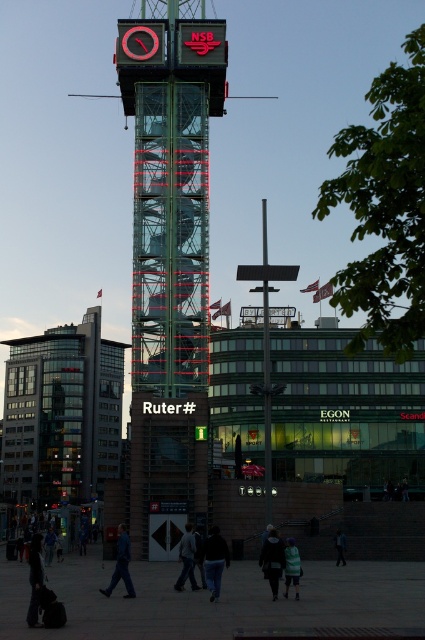
Question: Which point is farther to the camera?

Choices:
 (A) blue fabric jacket at lower center
 (B) glass building at left
 (C) dark blue jeans at lower center
 (D) dark gray jacket at center

Answer: (B)

Question: Where is dark blue jacket at center located in relation to blue fabric jacket at lower center in the image?

Choices:
 (A) below
 (B) above

Answer: (B)

Question: Does glass building at left appear over blue denim jeans at lower center?

Choices:
 (A) yes
 (B) no

Answer: (B)

Question: Can you confirm if transparent glass clock tower at center is positioned above blue denim jeans at lower center?

Choices:
 (A) yes
 (B) no

Answer: (A)

Question: Which object appears farthest from the camera in this image?

Choices:
 (A) glass building at left
 (B) blue denim jeans at lower center
 (C) dark blue jeans at center
 (D) dark blue jeans at lower left

Answer: (A)

Question: Which object is closer to the camera taking this photo?

Choices:
 (A) transparent glass clock tower at center
 (B) dark blue jacket at center
 (C) dark blue jeans at center
 (D) dark gray jacket at center

Answer: (C)